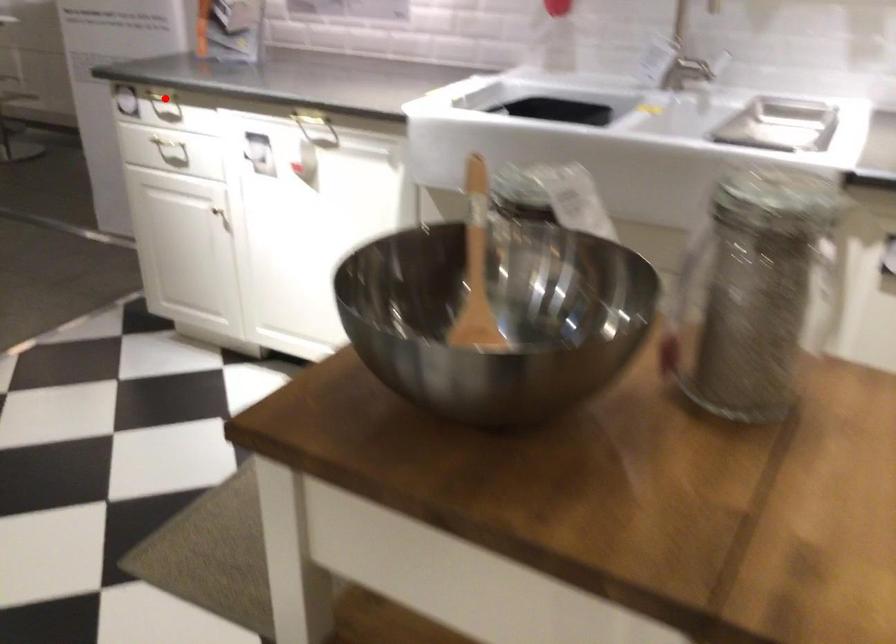
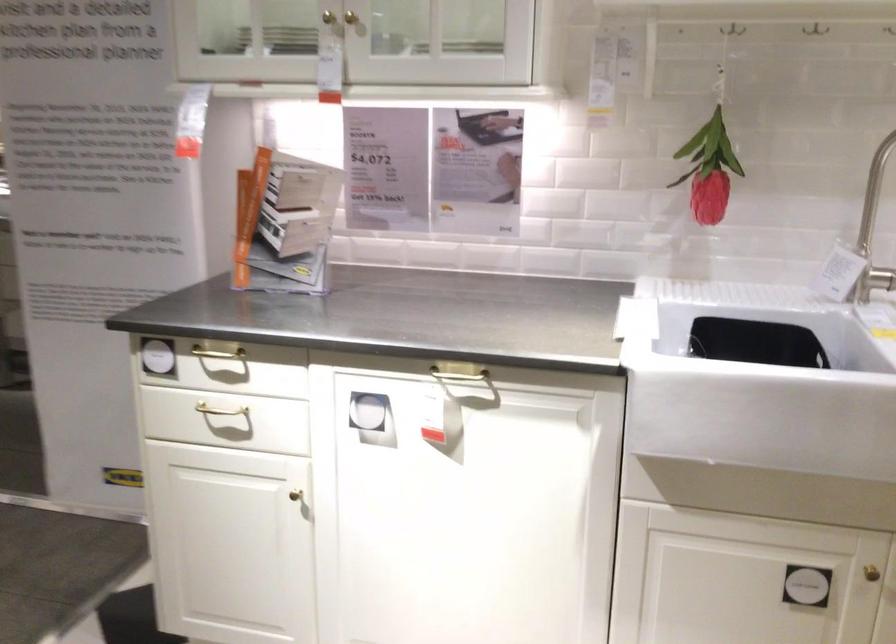
Question: I am providing you with two images of the same scene from different viewpoints. A red point is shown in image1. For the corresponding object point in image2, is it positioned nearer or farther from the camera?

Choices:
 (A) Nearer
 (B) Farther

Answer: (A)